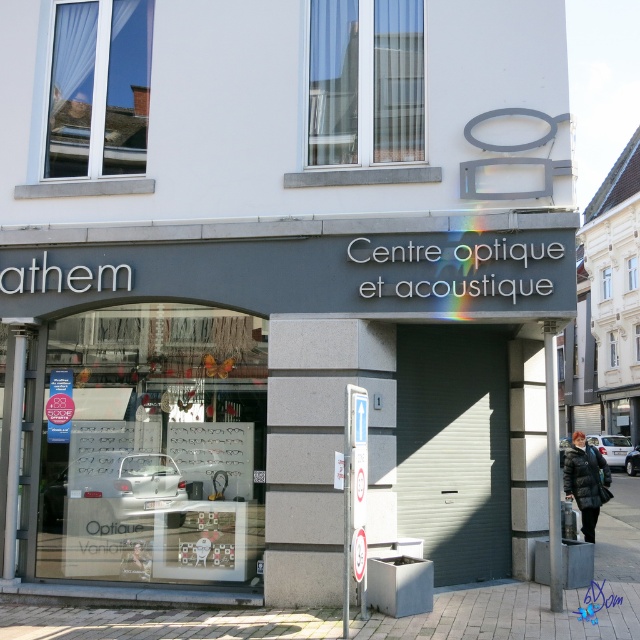
You are a customer standing in front of the store entrance. You see the brick pavement at lower center and the dark blue puffer jacket at lower right. Which object is located to the left of the other?

The brick pavement at lower center is positioned on the left side of dark blue puffer jacket at lower right, so the brick pavement at lower center is to the left of the dark blue puffer jacket at lower right.

You are a window cleaner standing at the brick pavement at lower center looking up at the matte gray storefront at center. Which object is taller?

The matte gray storefront at center is much taller than the brick pavement at lower center.

You are standing in front of the store entrance and want to take a photo. There are two points marked on the storefront at coordinates point (452, 241) and point (83, 608). Which point should you focus on to ensure it appears larger in your photo?

You should focus on point (452, 241) because it is closer to the camera and will appear larger in the photo compared to point (83, 608), which is further away.